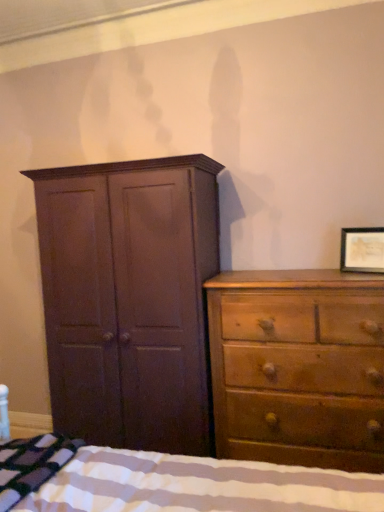
Question: From a real-world perspective, is wooden framed picture at upper right above or below striped cotton blanket at lower left?

Choices:
 (A) above
 (B) below

Answer: (A)

Question: Does point click(x=352, y=227) appear closer or farther from the camera than point click(x=31, y=466)?

Choices:
 (A) closer
 (B) farther

Answer: (B)

Question: Estimate the real-world distances between objects in this image. Which object is closer to the wooden framed picture at upper right?

Choices:
 (A) striped fabric bed at lower left
 (B) light brown wood dresser at right
 (C) matte brown cupboard at left
 (D) striped cotton blanket at lower left

Answer: (B)

Question: Considering the real-world distances, which object is closest to the striped fabric bed at lower left?

Choices:
 (A) light brown wood dresser at right
 (B) matte brown cupboard at left
 (C) wooden framed picture at upper right
 (D) striped cotton blanket at lower left

Answer: (D)